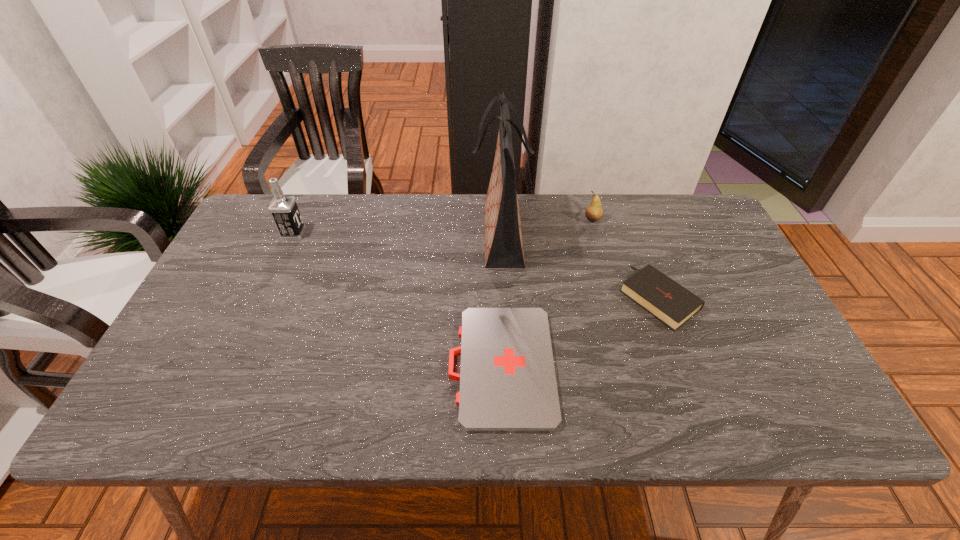
Identify the location of vacant space that's between the vodka and the Bible. (476, 266).

Find the location of `unoccupied position between the Bible and the shortest object`. unoccupied position between the Bible and the shortest object is located at coordinates (580, 332).

Locate an element on the screen. vacant area that lies between the pear and the shopping bag is located at coordinates (546, 227).

Where is `vacant space that is in between the shopping bag and the pear`? vacant space that is in between the shopping bag and the pear is located at coordinates (546, 227).

Where is `empty space between the pear and the first-aid kit`? This screenshot has height=540, width=960. empty space between the pear and the first-aid kit is located at coordinates (547, 293).

The height and width of the screenshot is (540, 960). Find the location of `free space between the third shortest object and the shortest object`. free space between the third shortest object and the shortest object is located at coordinates (547, 293).

Identify which object is located as the nearest to the Bible. Please provide its 2D coordinates. Your answer should be formatted as a tuple, i.e. [(x, y)], where the tuple contains the x and y coordinates of a point satisfying the conditions above.

[(594, 212)]

Point out which object is positioned as the fourth nearest to the Bible. Please provide its 2D coordinates. Your answer should be formatted as a tuple, i.e. [(x, y)], where the tuple contains the x and y coordinates of a point satisfying the conditions above.

[(284, 210)]

The image size is (960, 540). In order to click on free space that satisfies the following two spatial constraints: 1. on the front-facing side of the shopping bag; 2. on the right side of the second shortest object in this screenshot , I will do `click(504, 297)`.

Where is `free space that satisfies the following two spatial constraints: 1. on the front side of the third shortest object; 2. on the front-facing side of the tallest object`? This screenshot has width=960, height=540. free space that satisfies the following two spatial constraints: 1. on the front side of the third shortest object; 2. on the front-facing side of the tallest object is located at coordinates [597, 234].